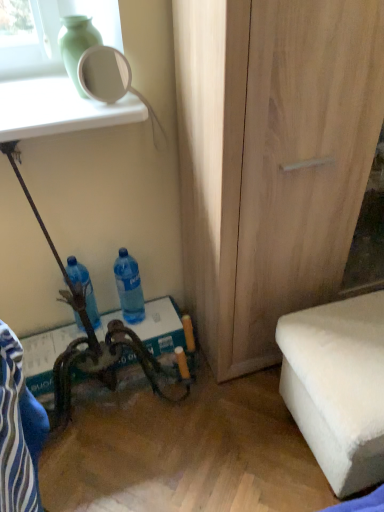
Question: In the image, is green matte vase at upper left on the left side or the right side of white fluffy ottoman at lower right?

Choices:
 (A) right
 (B) left

Answer: (B)

Question: From the image's perspective, is green matte vase at upper left located above or below white fluffy ottoman at lower right?

Choices:
 (A) above
 (B) below

Answer: (A)

Question: Which is farther from the white fluffy ottoman at lower right?

Choices:
 (A) blue translucent bottle at lower center, placed as the 2th bottle when sorted from left to right
 (B) blue fabric swivel chair at lower left
 (C) white glossy mirror at upper left
 (D) green matte vase at upper left
 (E) light wood cabinet at center

Answer: (C)

Question: Estimate the real-world distances between objects in this image. Which object is farther from the blue fabric swivel chair at lower left?

Choices:
 (A) light wood cabinet at center
 (B) blue plastic bottle at lower left, which appears as the first bottle when viewed from the left
 (C) white fluffy ottoman at lower right
 (D) green matte vase at upper left
 (E) blue translucent bottle at lower center, placed as the 2th bottle when sorted from left to right

Answer: (E)